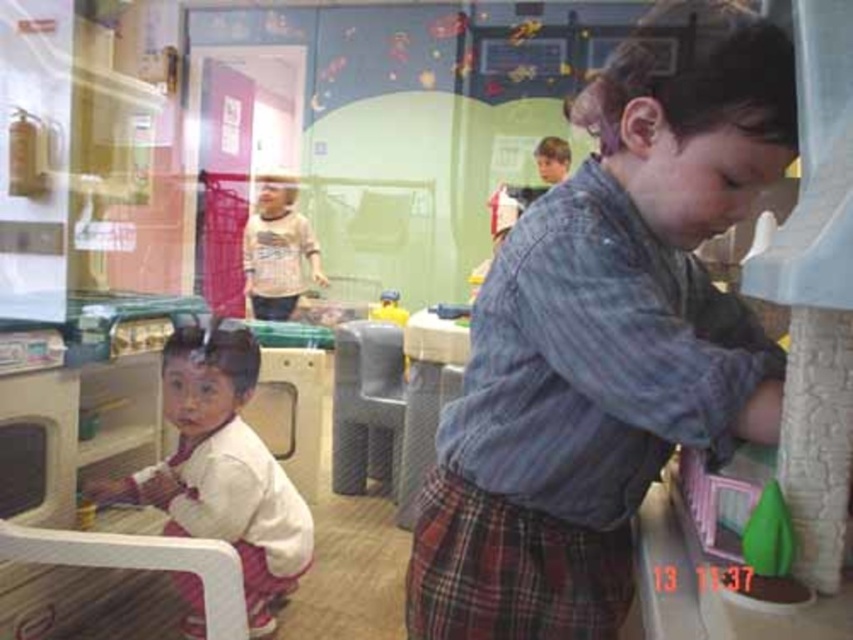
You are a photographer standing in the daycare room. You want to take a photo of both the point at (407, 570) and the point at (286, 253). Which point should you focus on first to ensure both are in sharp focus?

You should focus on the point at (286, 253) first because it is farther from the camera than the point at (407, 570). By focusing on the farther point, the closer point will also be in focus due to the depth of field.